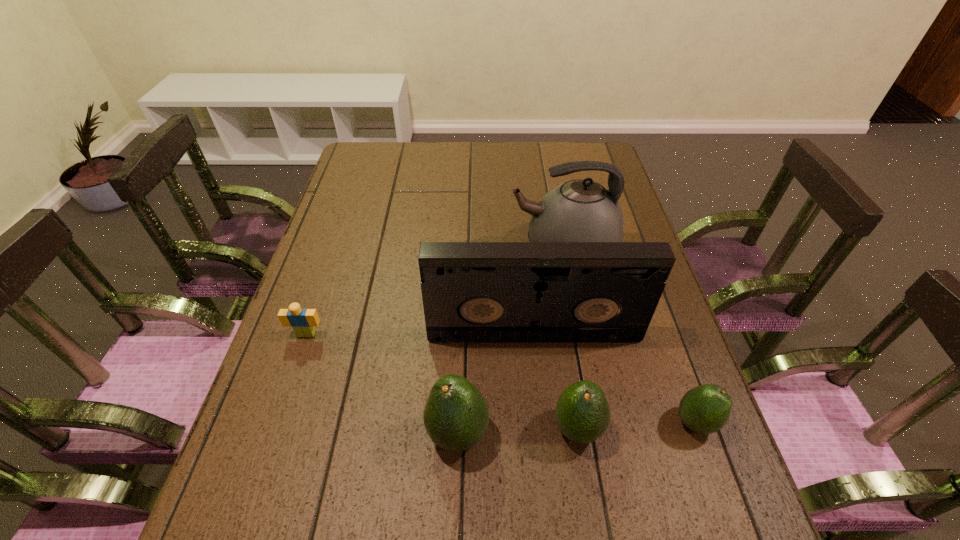
At what (x,y) coordinates should I click in order to perform the action: click on the leftmost avocado. Please return your answer as a coordinate pair (x, y). Looking at the image, I should click on (456, 416).

The image size is (960, 540). What are the coordinates of `the second tallest avocado` in the screenshot? It's located at (582, 412).

You are a GUI agent. You are given a task and a screenshot of the screen. Output one action in this format:
    pyautogui.click(x=<x>, y=<y>)
    Task: Click on the fourth tallest object
    Image resolution: width=960 pixels, height=540 pixels.
    Given the screenshot: What is the action you would take?
    pyautogui.click(x=582, y=412)

Locate an element on the screen. The image size is (960, 540). the fifth tallest object is located at coordinates (705, 409).

At what (x,y) coordinates should I click in order to perform the action: click on the rightmost avocado. Please return your answer as a coordinate pair (x, y). This screenshot has height=540, width=960. Looking at the image, I should click on (705, 409).

Locate an element on the screen. The image size is (960, 540). videotape is located at coordinates (473, 292).

I want to click on the farthest object, so click(x=580, y=210).

Locate an element on the screen. This screenshot has height=540, width=960. the leftmost object is located at coordinates (302, 321).

This screenshot has width=960, height=540. I want to click on the shortest object, so click(x=302, y=321).

I want to click on free space located 0.220m on the right of the leftmost avocado, so click(x=599, y=434).